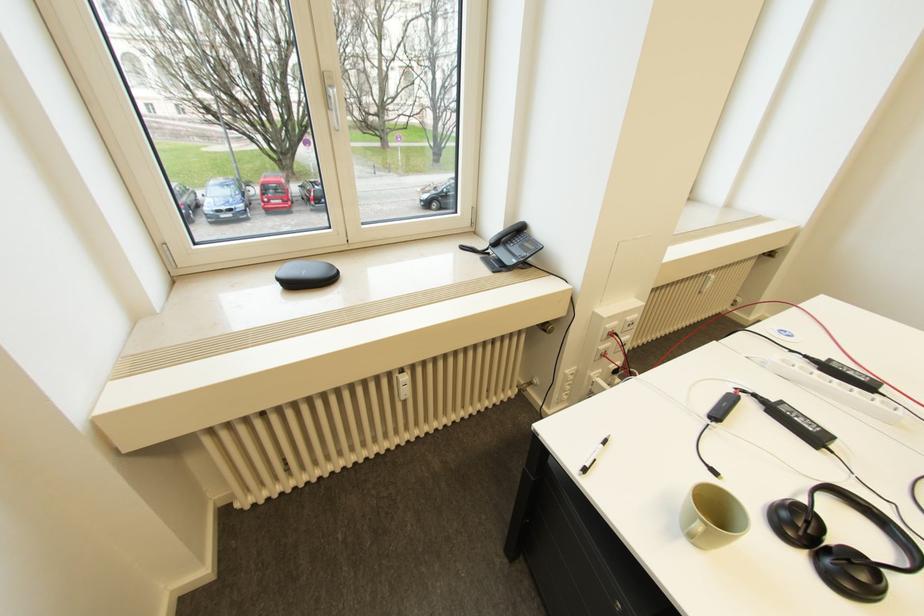
Which object does [711,516] point to?

It refers to a greenish cup.